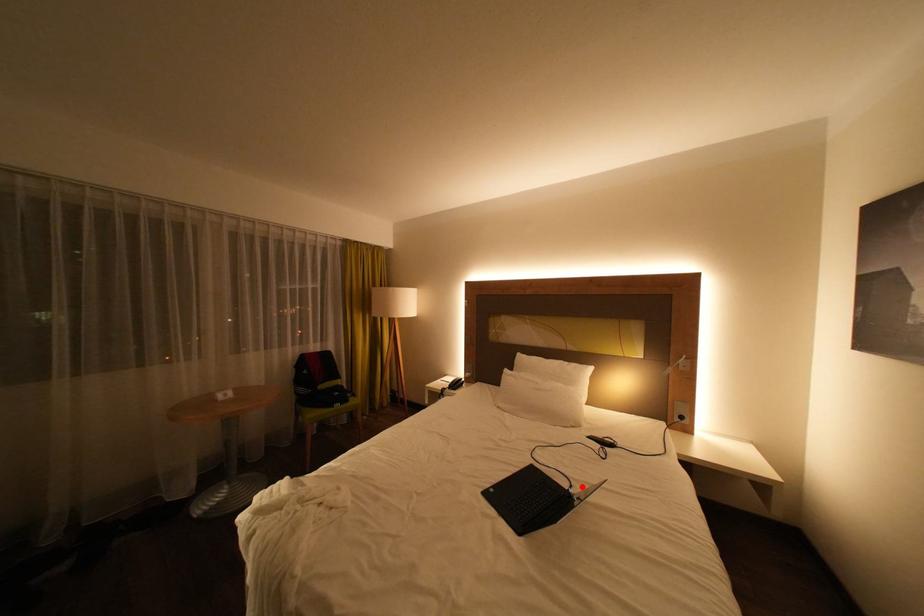
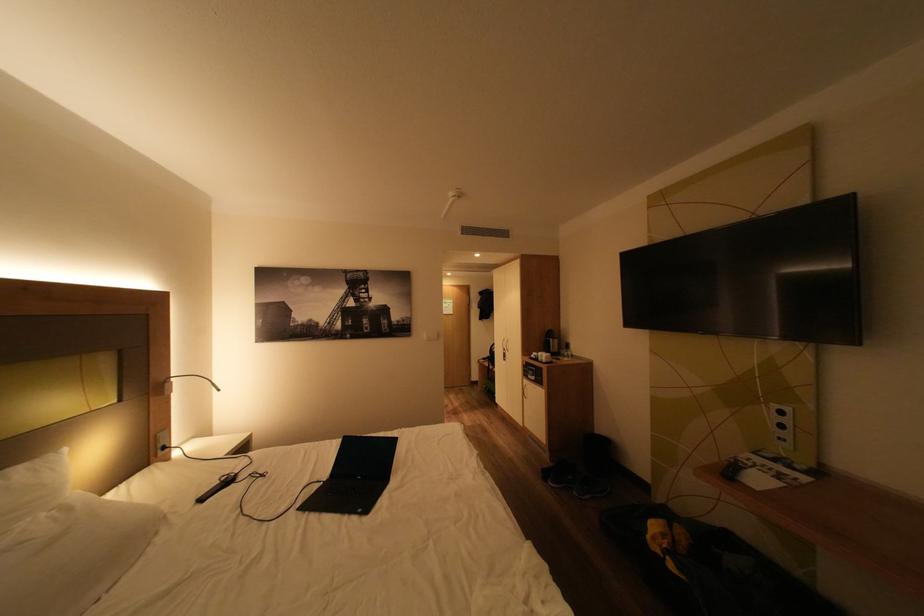
Question: I am providing you with two images of the same scene from different viewpoints. A red point is marked on the first image. At the location where the point appears in image 1, is it still visible in image 2?

Choices:
 (A) Yes
 (B) No

Answer: (A)